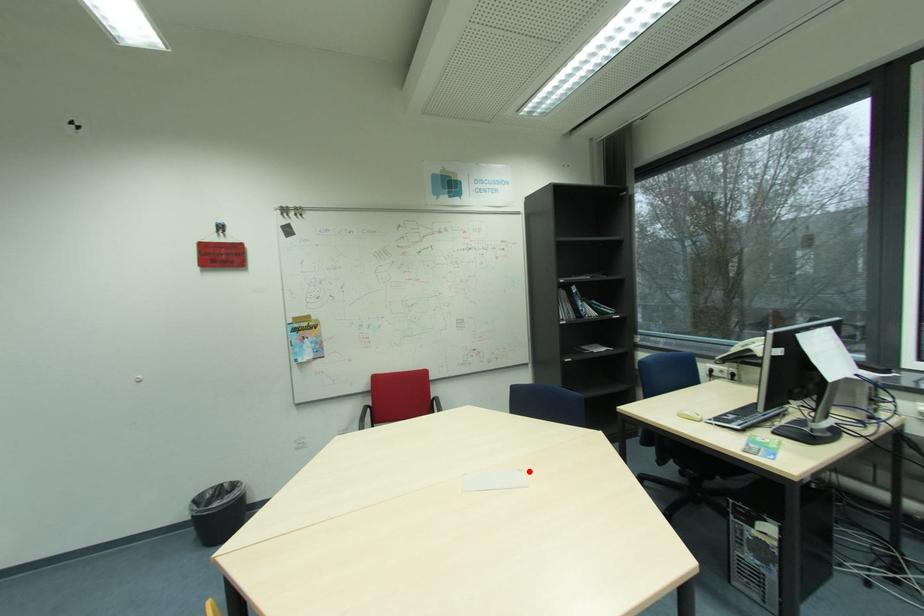
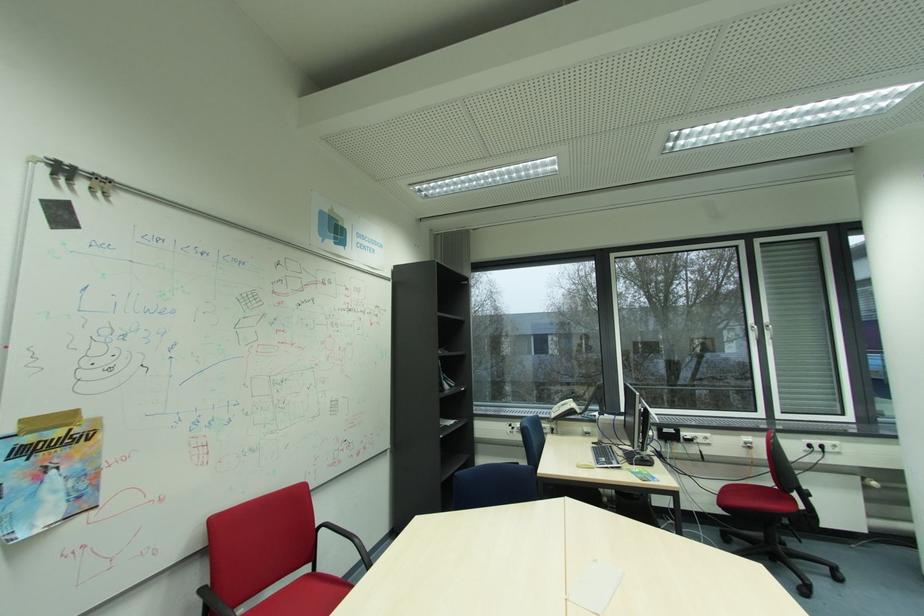
In the second image, find the point that corresponds to the highlighted location in the first image.

(602, 562)